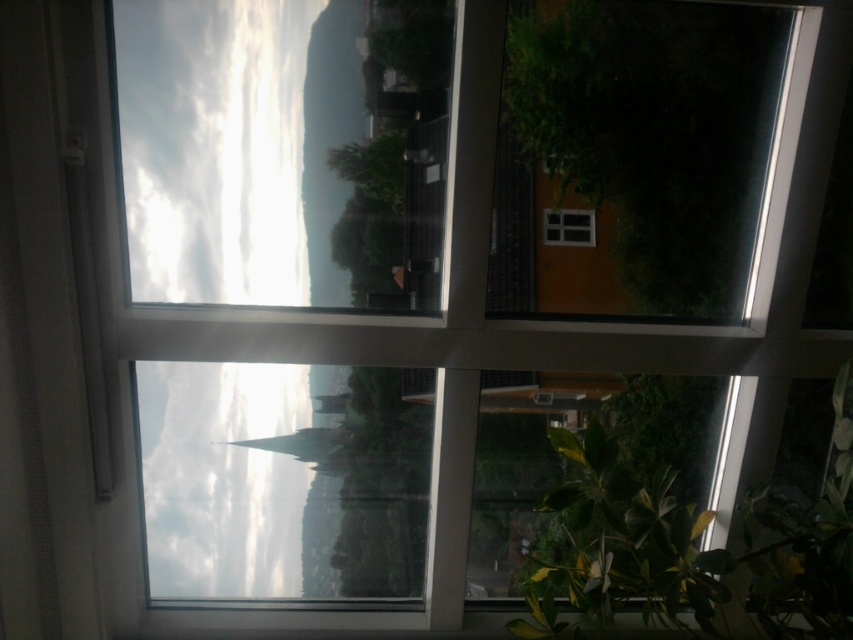
Question: Does green leafy plant at lower right have a larger size compared to clear glass window at center?

Choices:
 (A) yes
 (B) no

Answer: (A)

Question: Considering the relative positions of green leafy plant at lower right and clear glass window at center in the image provided, where is green leafy plant at lower right located with respect to clear glass window at center?

Choices:
 (A) above
 (B) below

Answer: (B)

Question: Which object is closer to the camera taking this photo?

Choices:
 (A) clear glass window at center
 (B) green leafy plant at lower right

Answer: (B)

Question: Is green leafy plant at lower right further to camera compared to clear glass window at center?

Choices:
 (A) no
 (B) yes

Answer: (A)